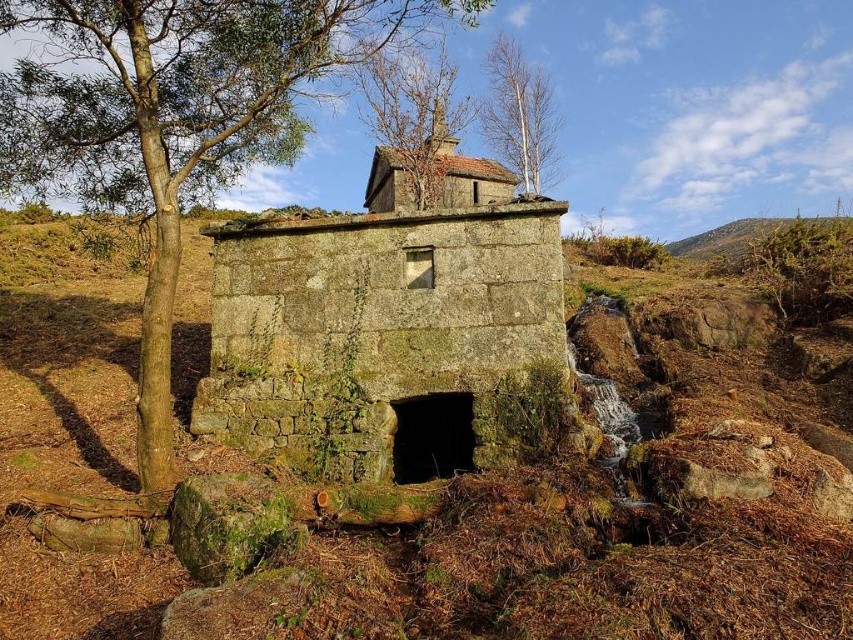
You are standing at the entrance of the old stone structure and want to walk to a specific location. If you move towards the point labeled as point (653, 525), will you pass by the point labeled as point (148, 218) first?

Since point (653, 525) is in front of point (148, 218), you will reach point (653, 525) before passing point (148, 218).

You are standing in front of the green mossy stone bunker at center and want to walk towards the brown leafy tree at upper center. Which direction should you move?

You should move to the left because the green mossy stone bunker at center is to the right of the brown leafy tree at upper center, so moving left will take you toward the tree.

You are standing in front of the rustic stone structure and want to determine the relative positions of two points marked on the image. Which point is closer to you, point at coordinate (492, 244) or point at coordinate (438, 141)?

Point at coordinate (492, 244) is closer to you than point at coordinate (438, 141).